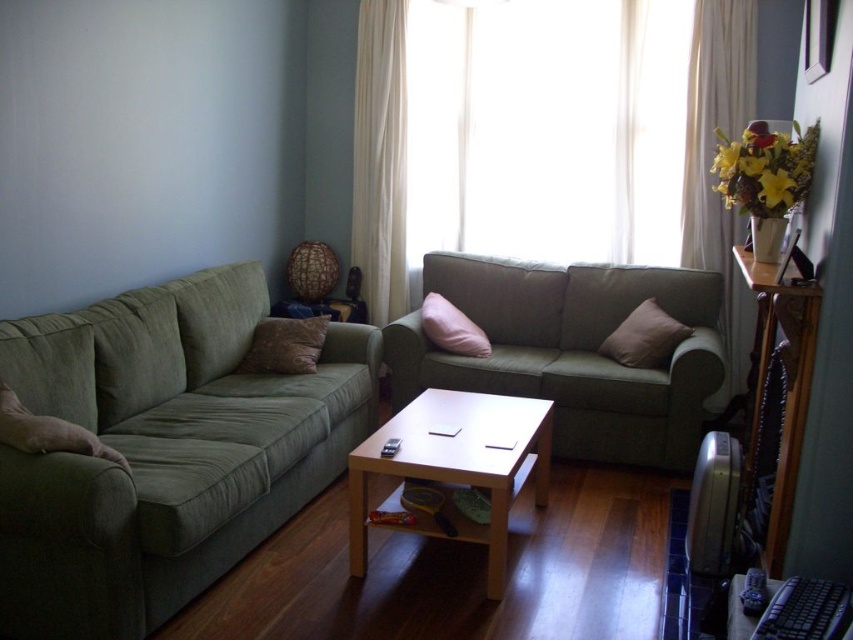
Who is more distant from viewer, (599,275) or (374,179)?

Positioned behind is point (374,179).

Can you confirm if matte green couch at center is shorter than white sheer curtain at upper center?

Indeed, matte green couch at center has a lesser height compared to white sheer curtain at upper center.

Does point (482, 364) come in front of point (381, 0)?

That is True.

Find the location of `matte green couch at center`. matte green couch at center is located at coordinates (572, 353).

Is white sheer curtain at upper right thinner than wooden table at right?

Yes.

Between white sheer curtain at upper right and wooden table at right, which one is positioned lower?

wooden table at right is lower down.

The image size is (853, 640). Identify the location of white sheer curtain at upper right. (711, 163).

Is point (80, 620) closer to viewer compared to point (363, 224)?

Yes, point (80, 620) is in front of point (363, 224).

Image resolution: width=853 pixels, height=640 pixels. I want to click on green suede couch at left, so click(x=163, y=451).